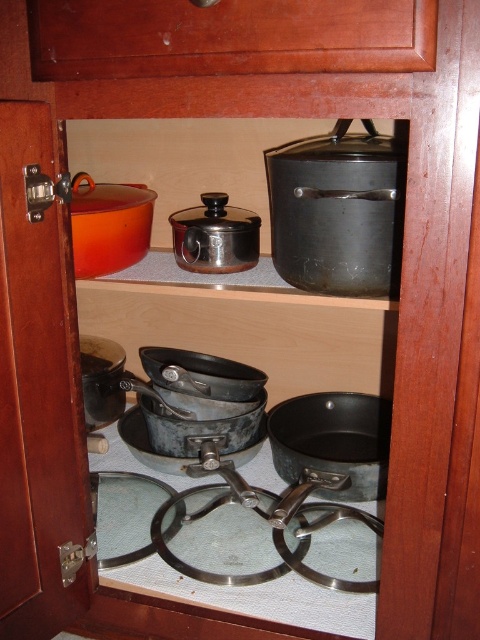
You are organizing the kitchen cabinet and need to stack the metallic glass cookware at center and the matte black frying pan at left. Which one should go on the bottom to ensure stability?

The metallic glass cookware at center is much taller than the matte black frying pan at left, so it should be placed on the bottom to ensure stability.

Based on the photo, you need to store a rectangular cutting board that is 20 cm wide. You see the wooden drawer at upper center and the black matte frying pan at center. Which storage space can fit the cutting board if the drawer is wider than the frying pan?

The wooden drawer at upper center is wider than the black matte frying pan at center, so the cutting board can fit in the wooden drawer at upper center.

You are trying to reach the black matte frying pan at center in the kitchen cabinet. There is a wooden drawer at upper center in your way. Can you move the drawer out of the way to access the frying pan?

The wooden drawer at upper center is closer to the viewer than the black matte frying pan at center, so you can move the drawer to access the frying pan.